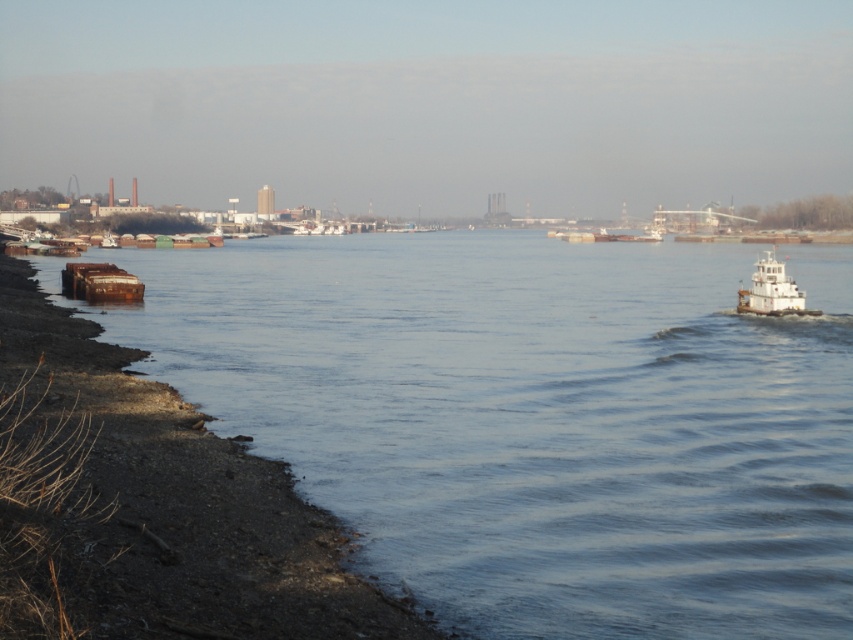
You are standing at the shoreline in the river scene and see two points marked in the image. The first point is at coordinates point (71, 360) and the second is at point (763, 260). Which point is closer to you?

Point (71, 360) is in front of point (763, 260), so the first point is closer to you.

You are a photographer planning to capture the blue water at lower left and the white matte tugboat at right in a single frame. Based on the scene, which object occupies a larger portion of the image horizontally?

The blue water at lower left occupies a larger horizontal portion of the image since its width surpasses that of the white matte tugboat at right according to the description.

You are a photographer standing at the riverbank and want to capture both point (x=410, y=275) and point (x=61, y=289) in your photo. Which point is closer to the camera?

Point (x=61, y=289) is closer to the camera because it is positioned nearer than point (x=410, y=275), which is further away.